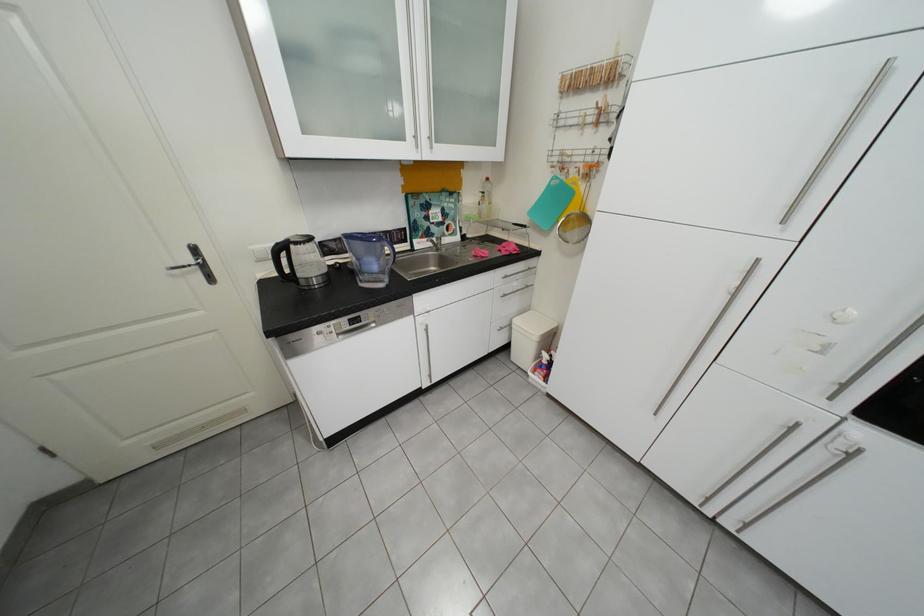
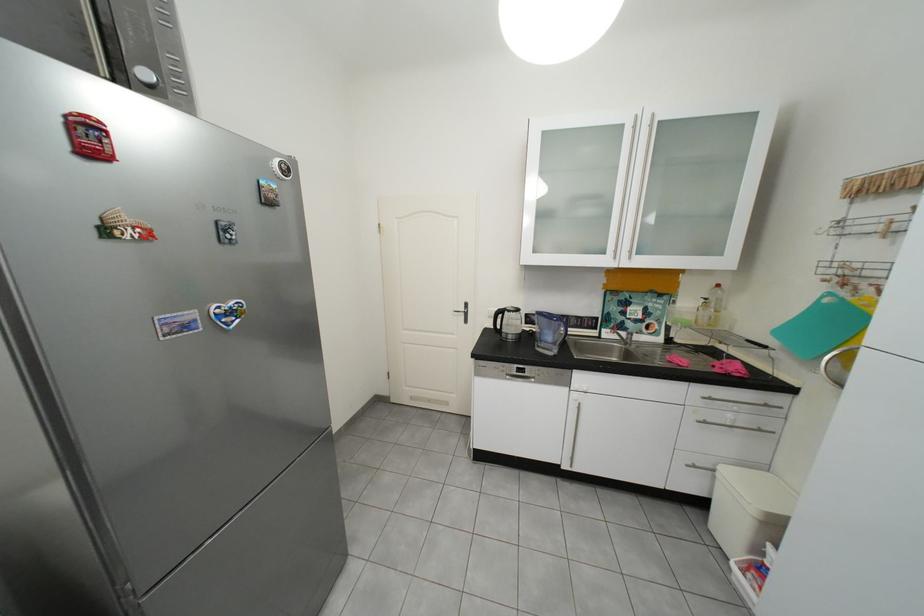
In the second image, find the point that corresponds to point 525,328 in the first image.

(730, 476)